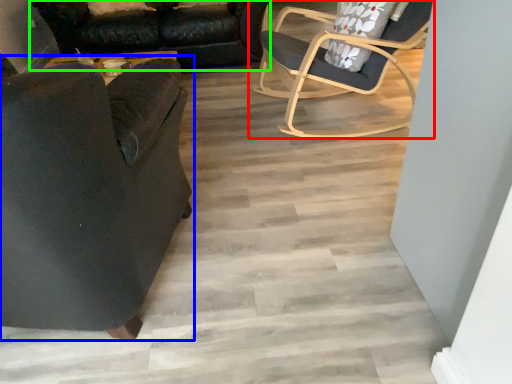
Question: Considering the real-world distances, which object is farthest from chair (highlighted by a red box)? chair (highlighted by a blue box) or studio couch (highlighted by a green box)?

Choices:
 (A) chair
 (B) studio couch

Answer: (A)